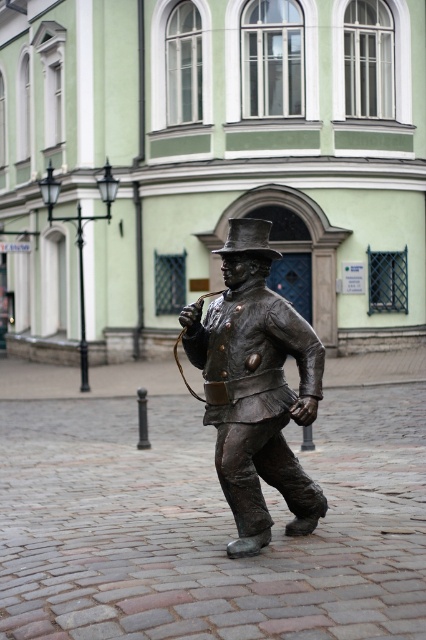
Question: Which point is closer to the camera?

Choices:
 (A) shiny bronze hat at center
 (B) bronze statue at center

Answer: (B)

Question: Among these objects, which one is farthest from the camera?

Choices:
 (A) shiny bronze hat at center
 (B) bronze statue at center

Answer: (A)

Question: Can you confirm if bronze statue at center is positioned to the right of shiny bronze hat at center?

Choices:
 (A) yes
 (B) no

Answer: (A)

Question: Is bronze statue at center to the right of shiny bronze hat at center from the viewer's perspective?

Choices:
 (A) yes
 (B) no

Answer: (A)

Question: Where is bronze statue at center located in relation to shiny bronze hat at center in the image?

Choices:
 (A) below
 (B) above

Answer: (A)